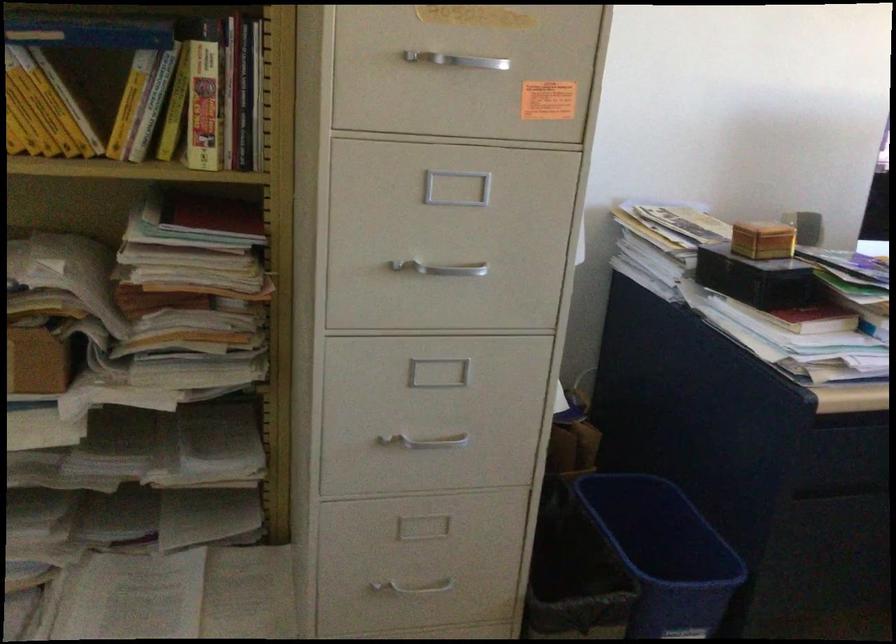
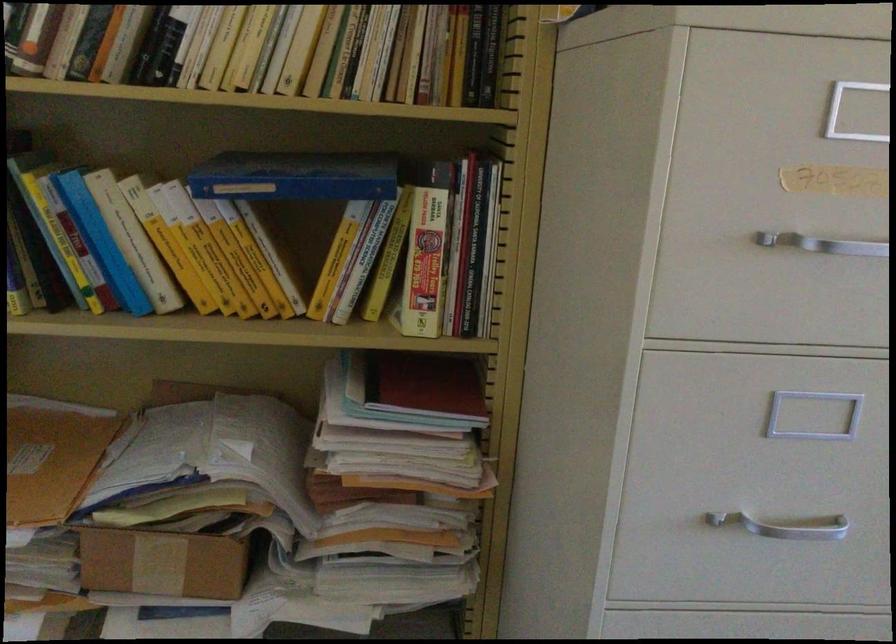
In a continuous first-person perspective shot, in which direction is the camera moving?

The cameraman moved toward left, forward.